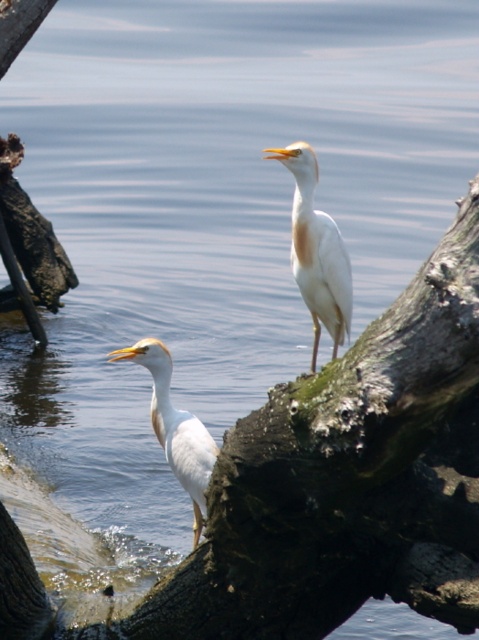
Question: Observing the image, what is the correct spatial positioning of white matte bird at center in reference to white smooth heron at lower left?

Choices:
 (A) below
 (B) above

Answer: (B)

Question: Which object is farther from the camera taking this photo?

Choices:
 (A) white matte bird at center
 (B) white smooth heron at lower left

Answer: (A)

Question: Observing the image, what is the correct spatial positioning of white matte bird at center in reference to white smooth heron at lower left?

Choices:
 (A) right
 (B) left

Answer: (A)

Question: Does white matte bird at center appear over white smooth heron at lower left?

Choices:
 (A) no
 (B) yes

Answer: (B)